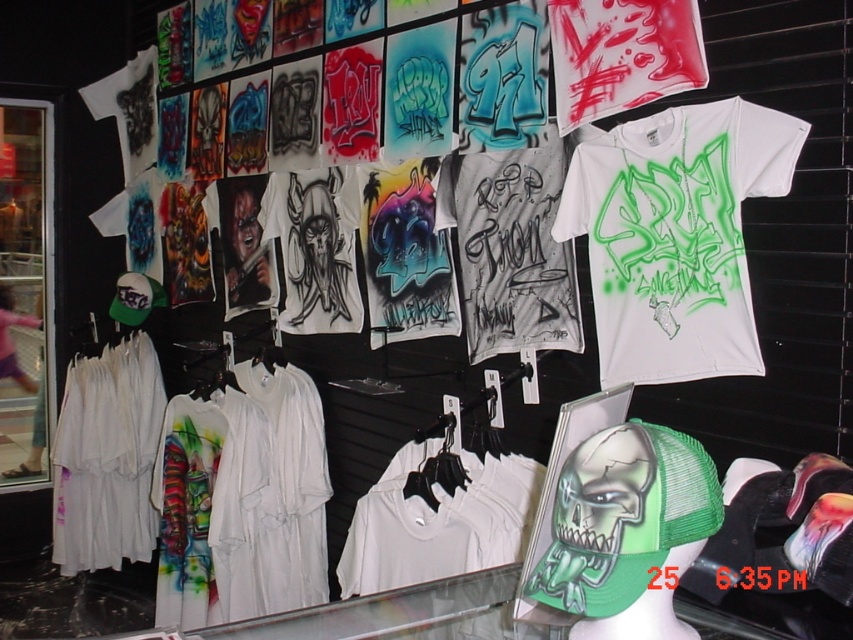
Which is below, white cotton t-shirt at center or transparent glass door at left?

Positioned lower is white cotton t-shirt at center.

Measure the distance from white cotton t-shirt at center to transparent glass door at left.

The distance of white cotton t-shirt at center from transparent glass door at left is 2.66 meters.

Identify the location of white cotton t-shirt at center. The height and width of the screenshot is (640, 853). (438, 524).

Which is more to the right, white cotton shirts at left or white cotton t-shirt at left?

white cotton shirts at left

Who is higher up, white cotton shirts at left or white cotton t-shirt at left?

white cotton t-shirt at left

Does point (142, 545) lie behind point (0, 355)?

No, (142, 545) is in front of (0, 355).

I want to click on white cotton shirts at left, so click(x=106, y=458).

Is white matte t-shirt at right to the left of transparent glass door at left from the viewer's perspective?

In fact, white matte t-shirt at right is to the right of transparent glass door at left.

Can you confirm if white matte t-shirt at right is taller than transparent glass door at left?

Incorrect, white matte t-shirt at right's height is not larger of transparent glass door at left's.

Is point (635, 212) closer to camera compared to point (27, 467)?

Yes, it is in front of point (27, 467).

Identify the location of white matte t-shirt at right. (675, 236).